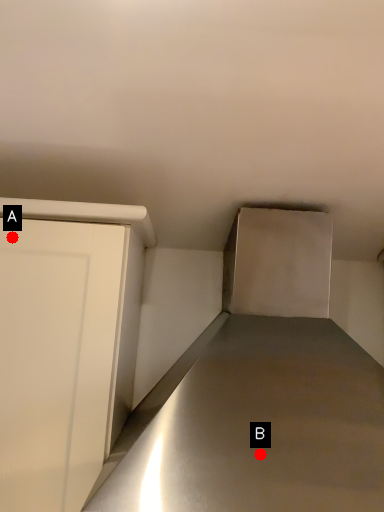
Question: Two points are circled on the image, labeled by A and B beside each circle. Which point is closer to the camera taking this photo?

Choices:
 (A) A is closer
 (B) B is closer

Answer: (B)